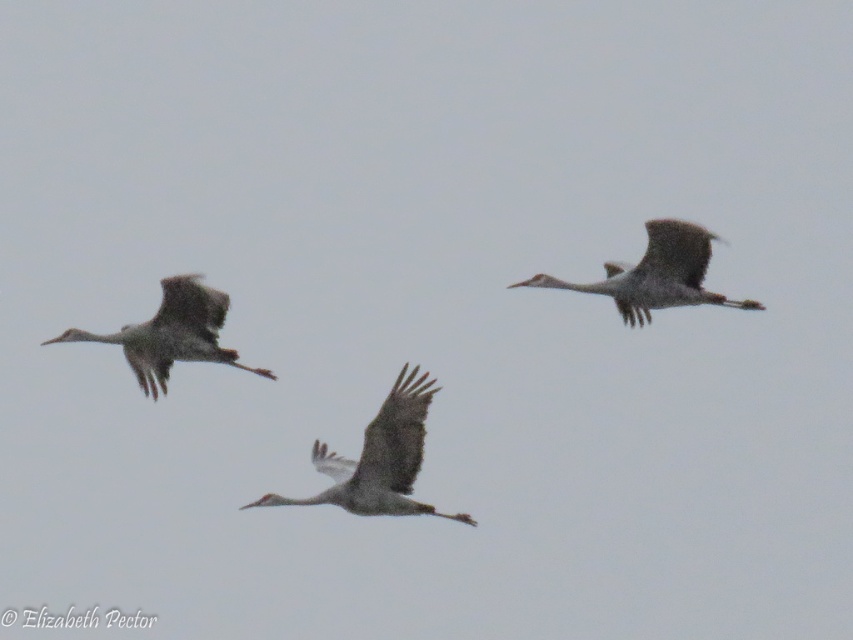
What do you see at coordinates (171, 333) in the screenshot? This screenshot has height=640, width=853. I see `gray feathered crane at left` at bounding box center [171, 333].

Is gray feathered crane at left to the left of gray feathered crane at upper right from the viewer's perspective?

Indeed, gray feathered crane at left is positioned on the left side of gray feathered crane at upper right.

The width and height of the screenshot is (853, 640). What do you see at coordinates (171, 333) in the screenshot?
I see `gray feathered crane at left` at bounding box center [171, 333].

Locate an element on the screen. This screenshot has height=640, width=853. gray feathered crane at left is located at coordinates pos(171,333).

Is gray feathered crane at center smaller than gray feathered crane at left?

Incorrect, gray feathered crane at center is not smaller in size than gray feathered crane at left.

Is the position of gray feathered crane at center more distant than that of gray feathered crane at left?

No, it is not.

Image resolution: width=853 pixels, height=640 pixels. Find the location of `gray feathered crane at center`. gray feathered crane at center is located at coordinates (378, 460).

This screenshot has width=853, height=640. In order to click on gray feathered crane at center in this screenshot , I will do `click(378, 460)`.

Which is above, gray feathered crane at center or gray feathered crane at upper right?

gray feathered crane at upper right is above.

Does gray feathered crane at center have a greater height compared to gray feathered crane at upper right?

Yes, gray feathered crane at center is taller than gray feathered crane at upper right.

Find the location of a particular element. gray feathered crane at center is located at coordinates (378, 460).